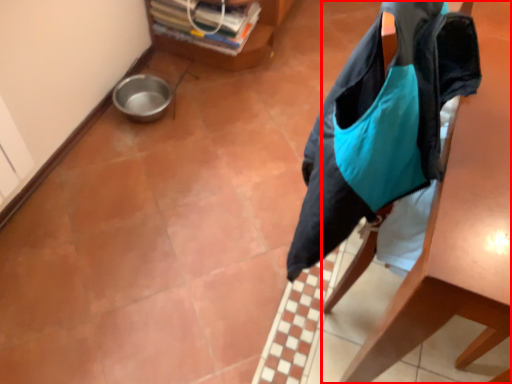
Question: From the image, what is the correct spatial relationship of furniture (annotated by the red box) in relation to furniture?

Choices:
 (A) left
 (B) right

Answer: (B)